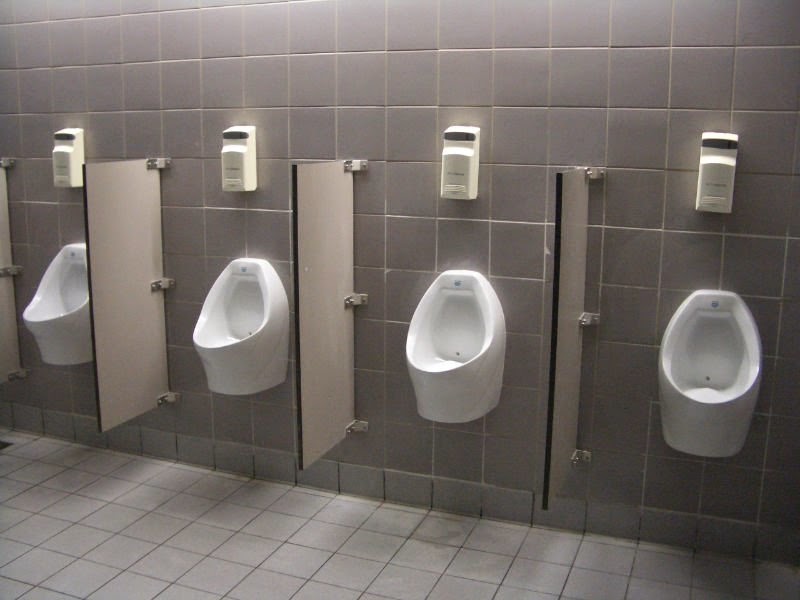
This screenshot has width=800, height=600. In order to click on urinals in this screenshot , I will do `click(58, 318)`, `click(218, 319)`, `click(434, 355)`, `click(729, 366)`.